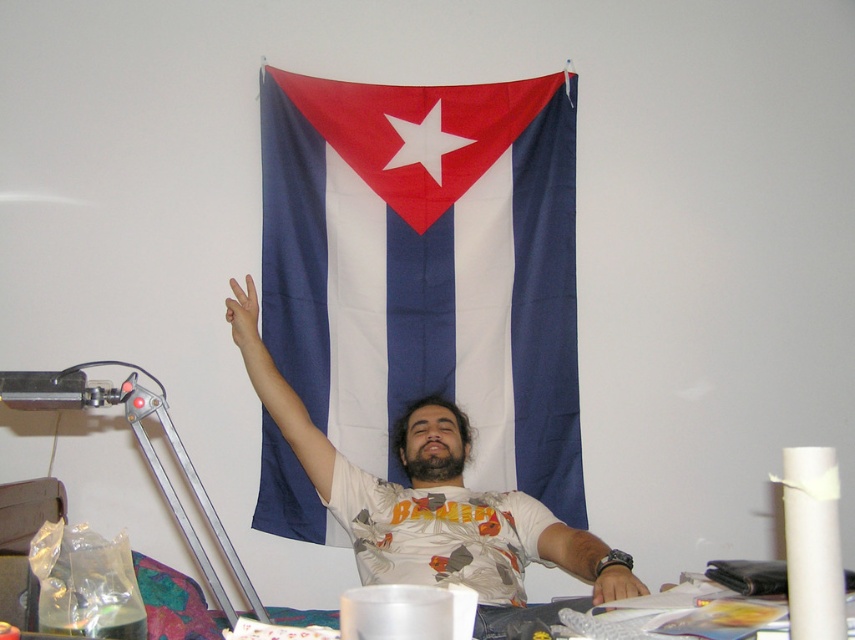
Question: Which object is the farthest from the matte white wristwatch at center?

Choices:
 (A) blue fabric flag at center
 (B) white matte arm at upper center
 (C) matte skin hand at upper center

Answer: (C)

Question: Is blue fabric flag at center above matte white t-shirt at center?

Choices:
 (A) yes
 (B) no

Answer: (A)

Question: Which object is positioned farthest from the matte skin hand at upper center?

Choices:
 (A) blue fabric flag at center
 (B) matte white t-shirt at center
 (C) matte white wristwatch at center
 (D) white matte arm at upper center

Answer: (C)

Question: Estimate the real-world distances between objects in this image. Which object is farther from the matte skin hand at upper center?

Choices:
 (A) matte white wristwatch at center
 (B) matte white arm at center

Answer: (A)

Question: Can you confirm if matte skin hand at upper center is positioned to the left of matte white wristwatch at center?

Choices:
 (A) yes
 (B) no

Answer: (A)

Question: From the image, what is the correct spatial relationship of blue fabric flag at center in relation to matte white wristwatch at center?

Choices:
 (A) left
 (B) right

Answer: (A)